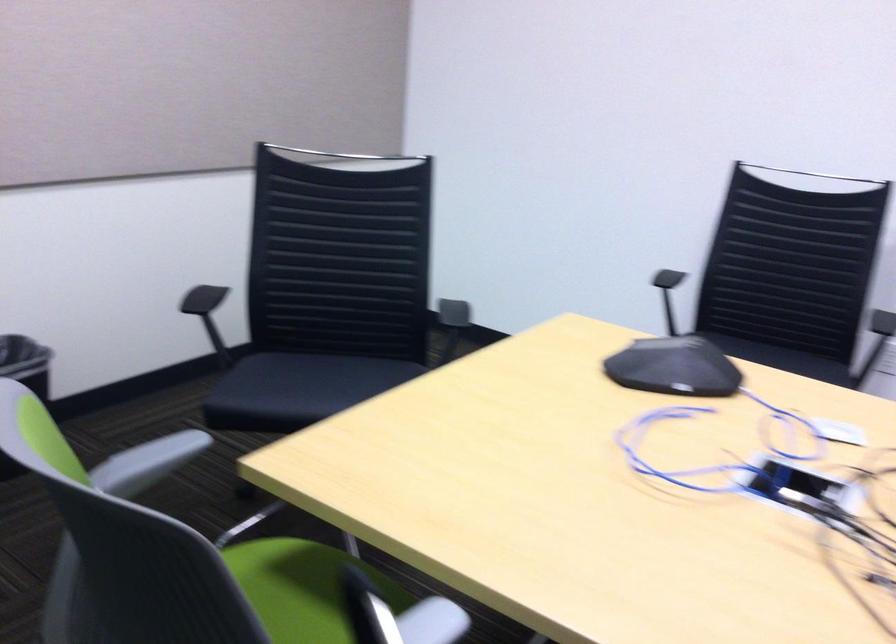
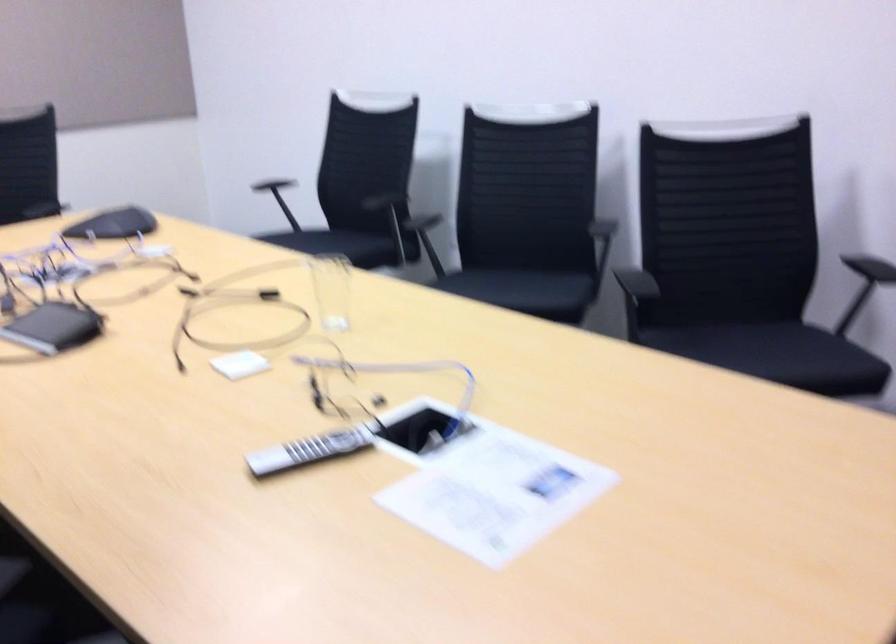
Find the pixel in the second image that matches pixel 510 252 in the first image.

(271, 184)